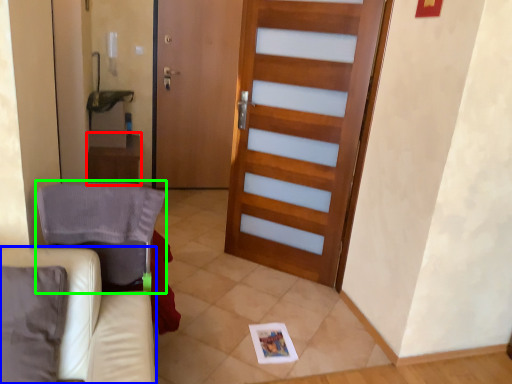
Question: Considering the real-world distances, which object is closest to table (highlighted by a red box)? furniture (highlighted by a blue box) or armchair (highlighted by a green box).

Choices:
 (A) furniture
 (B) armchair

Answer: (B)